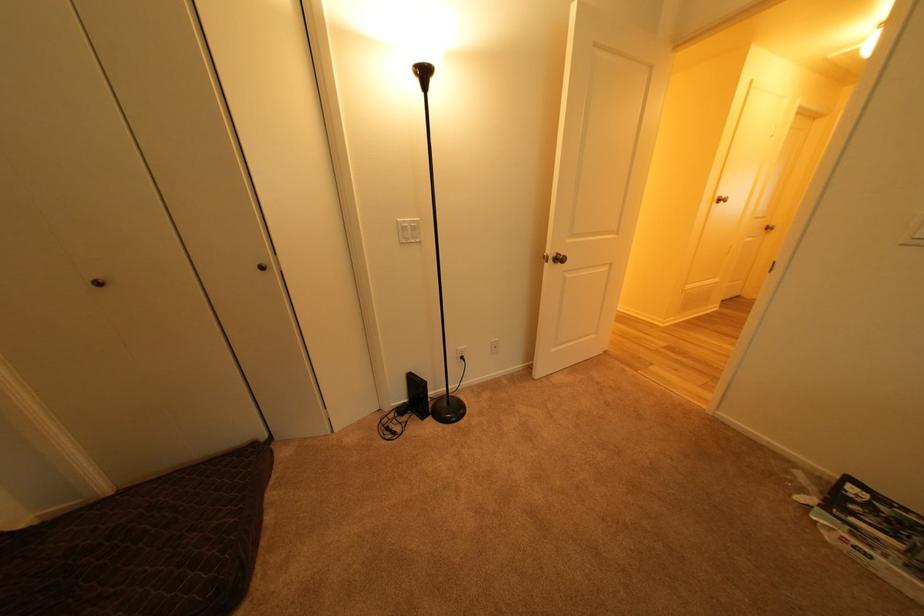
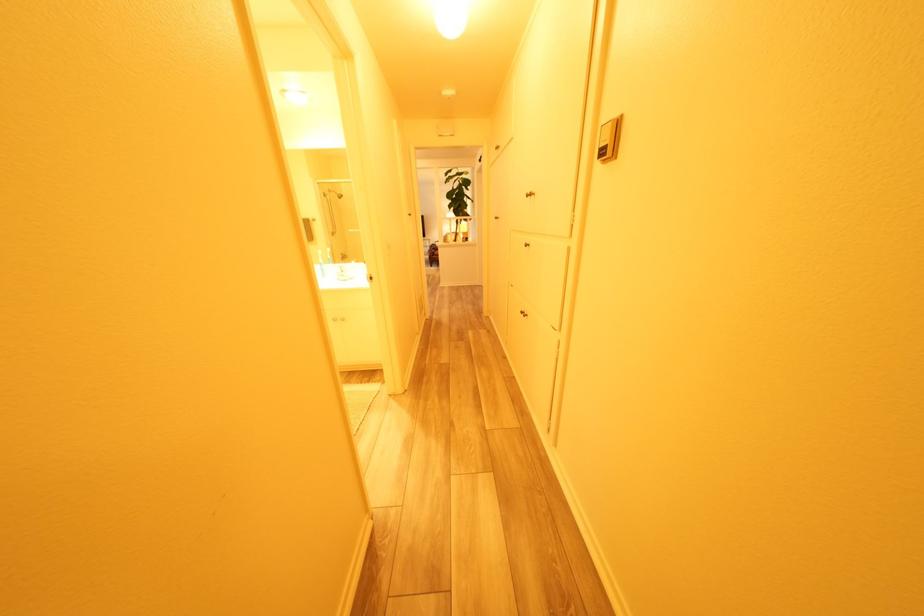
Which direction would the cameraman need to move to produce the second image?

The movement direction of the cameraman is right, forward.